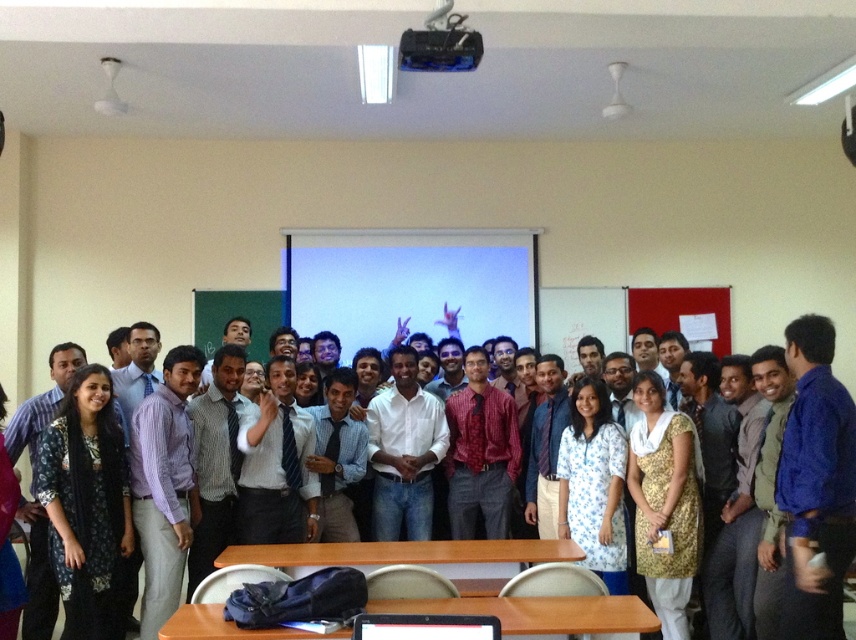
Is point (521, 620) closer to viewer compared to point (474, 564)?

Yes.

Between wooden table at center and brown wooden table at center, which one is positioned lower?

brown wooden table at center is lower down.

Find the location of a particular element. This screenshot has width=856, height=640. wooden table at center is located at coordinates (539, 612).

Does brown wooden table at center have a greater height compared to black glossy laptop at center?

Indeed, brown wooden table at center has a greater height compared to black glossy laptop at center.

Between point (495, 582) and point (432, 634), which one is positioned behind?

The point (495, 582) is more distant.

You are a GUI agent. You are given a task and a screenshot of the screen. Output one action in this format:
    pyautogui.click(x=<x>, y=<y>)
    Task: Click on the brown wooden table at center
    The height and width of the screenshot is (640, 856).
    Given the screenshot: What is the action you would take?
    pyautogui.click(x=413, y=557)

Is the position of wooden table at center more distant than that of black glossy laptop at center?

Yes, it is.

Does point (189, 616) lie behind point (426, 620)?

Yes, it is behind point (426, 620).

In order to click on wooden table at center in this screenshot , I will do `click(539, 612)`.